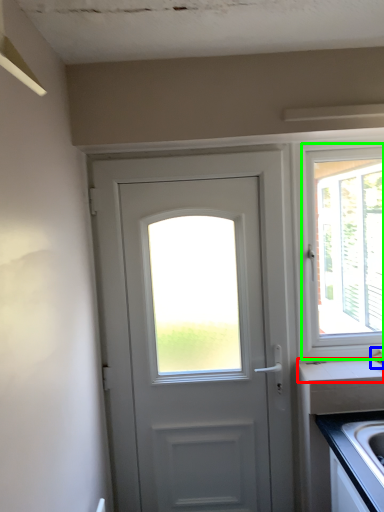
Question: Which object is the closest to the counter top (highlighted by a red box)? Choose among these: faucet (highlighted by a blue box) or window (highlighted by a green box).

Choices:
 (A) faucet
 (B) window

Answer: (A)